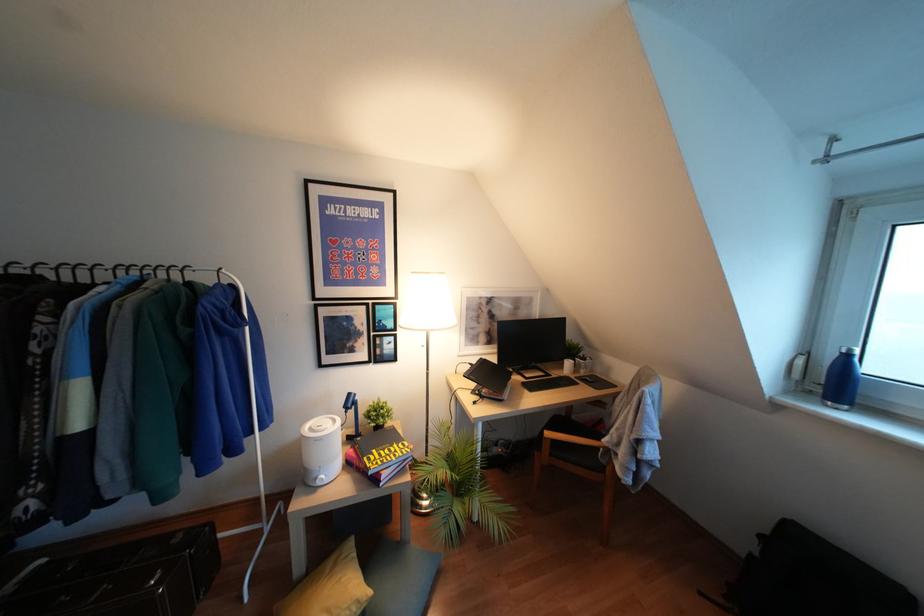
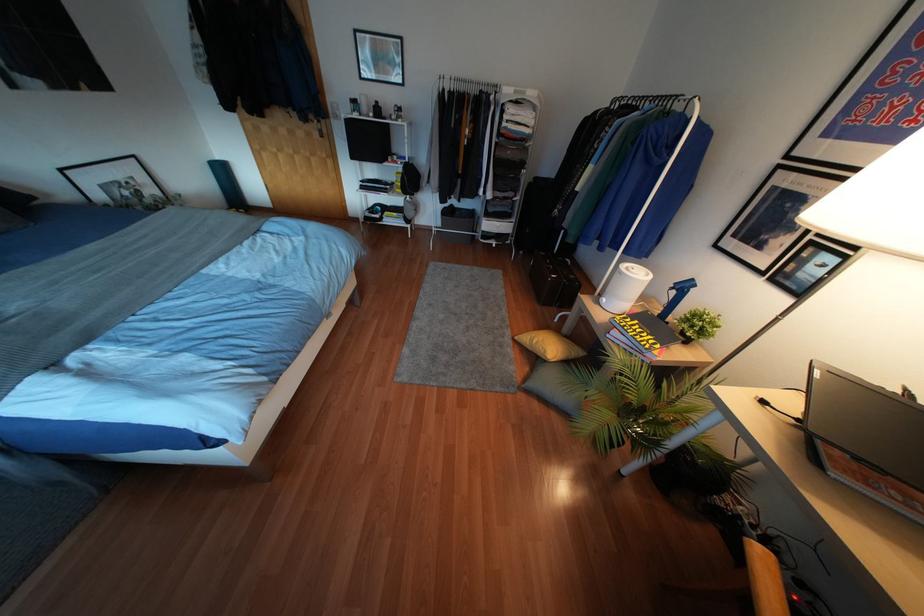
Where in the second image is the point corresponding to the point at 372,450 from the first image?

(637, 321)